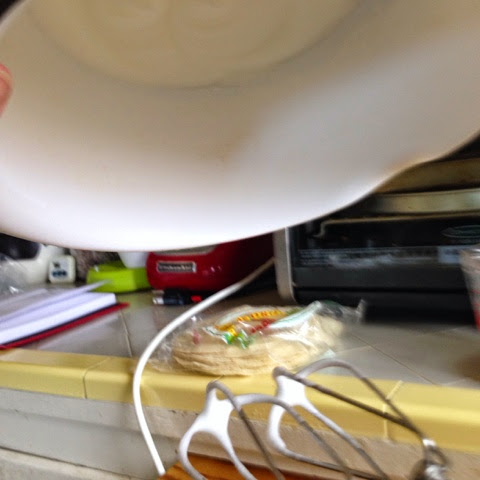
The width and height of the screenshot is (480, 480). What are the coordinates of `book` in the screenshot? It's located at (60, 303).